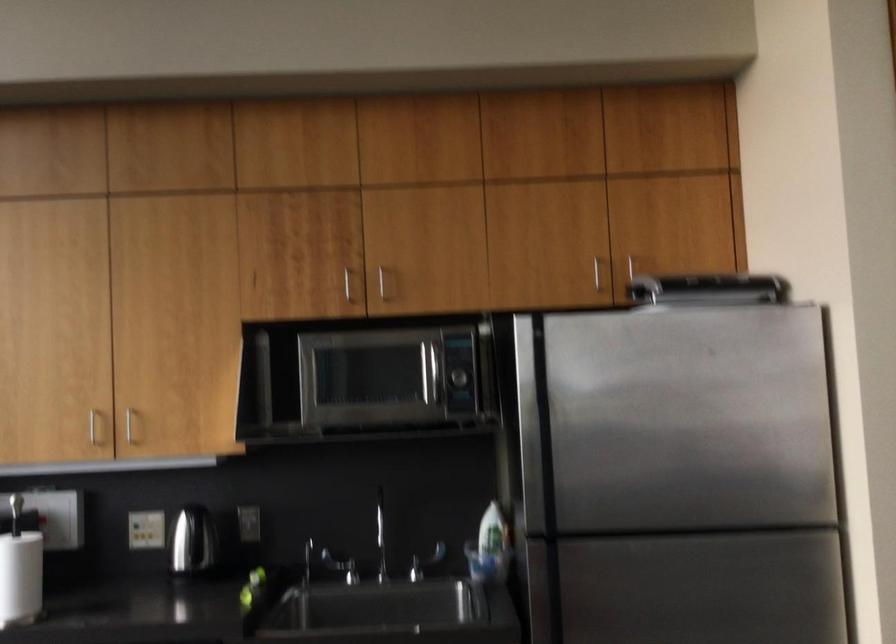
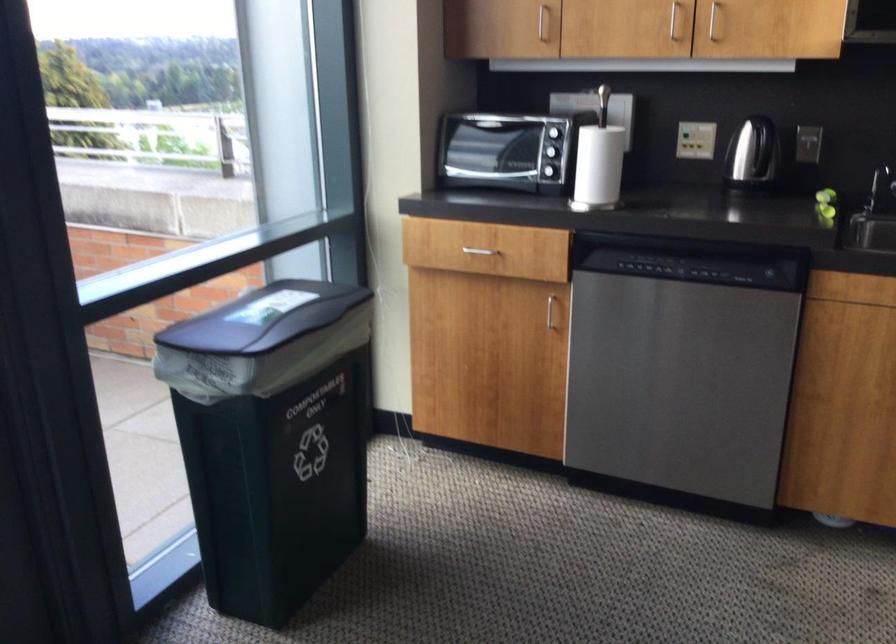
Locate, in the second image, the point that corresponds to pixel 188 544 in the first image.

(752, 152)